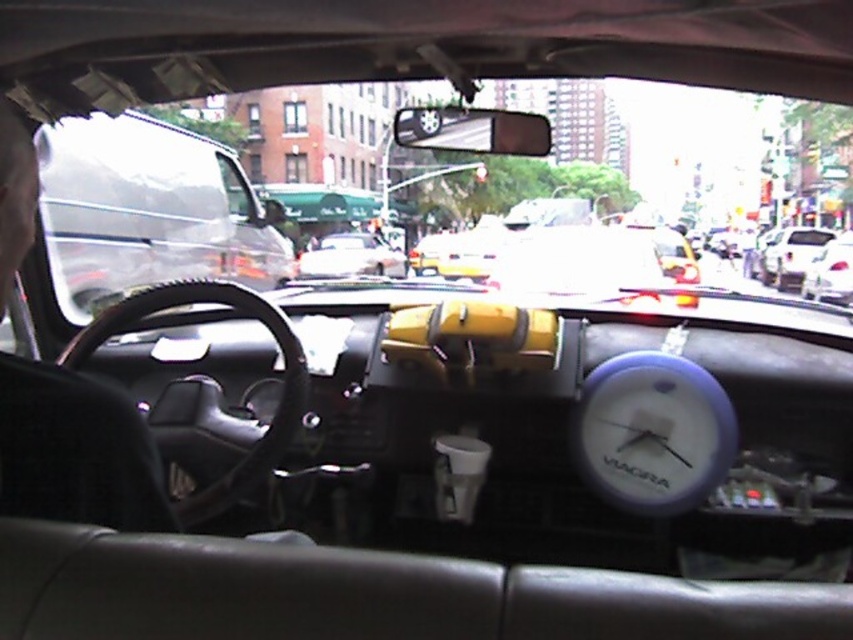
You are a passenger in a car and notice two items on the dashboard. You need to locate the yellow matte taxi at center. Which direction should you look relative to the white plastic clock at center?

The yellow matte taxi at center is to the left of the white plastic clock at center.

You are a passenger in a car and looking at the dashboard. You see a yellow matte taxi at center and a white glossy sedan at right. Which vehicle is taller?

The yellow matte taxi at center is shorter than the white glossy sedan at right, so the white glossy sedan at right is taller.

You are a passenger in a car and want to know the time. You see the white plastic clock at center and the white glossy sedan at right. Which object is closer to the left side of the dashboard?

The white plastic clock at center is positioned on the left side of the white glossy sedan at right, so it is closer to the left side of the dashboard.